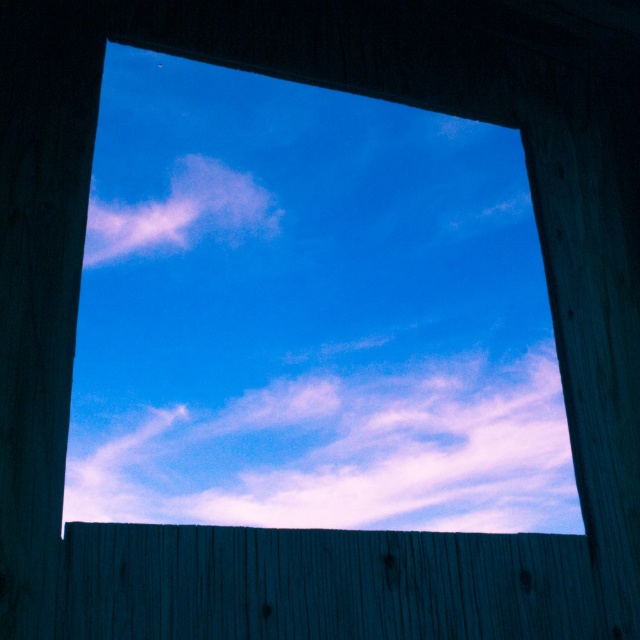
You are holding a camera and want to take a photo of the smooth wooden fence at bottom. If you are standing 1.62 meters away from the fence, is this distance considered close enough for a clear, detailed photo?

The smooth wooden fence at bottom and camera are 1.62 meters apart, so this distance is close enough for a clear, detailed photo.

You are an astronaut floating in space near the International Space Station. You have a small drone that needs to be guided through a narrow passage between the transparent glass window at center and the pink cotton cloud at upper center. The drone has a maximum safe distance requirement of 20 centimeters between itself and any obstacles. Based on the scene description, can the drone safely navigate this path without coming too close to either object?

The transparent glass window at center is 22.28 centimeters away from the pink cotton cloud at upper center. Since the drone requires a minimum of 20 centimeters between itself and obstacles, this distance is sufficient for safe passage as 22.28 cm exceeds the 20 cm safety margin.